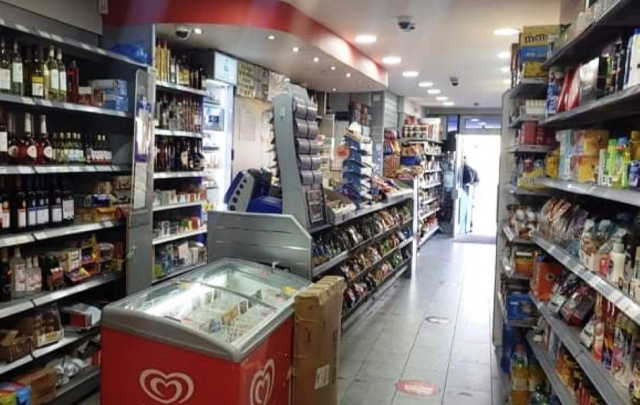
This screenshot has width=640, height=405. I want to click on cardboard box next to freezerice cream freezer, so click(x=308, y=347), click(x=208, y=374).